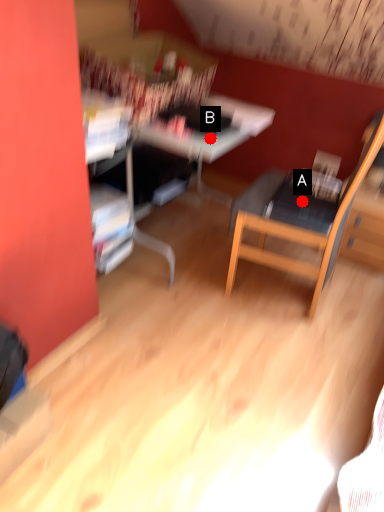
Question: Two points are circled on the image, labeled by A and B beside each circle. Which point is farther from the camera taking this photo?

Choices:
 (A) A is further
 (B) B is further

Answer: (A)